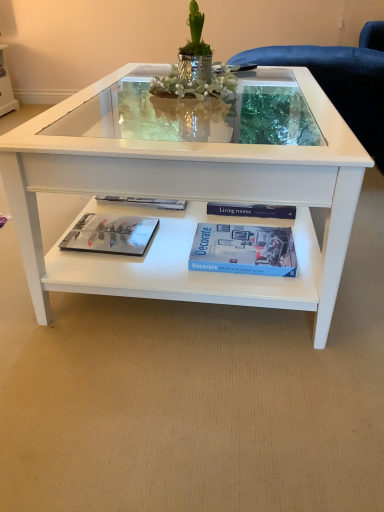
The width and height of the screenshot is (384, 512). Describe the element at coordinates (110, 234) in the screenshot. I see `matte glossy magazine at lower left` at that location.

Identify the location of blue matte book at center. (243, 250).

The width and height of the screenshot is (384, 512). Find the location of `white glossy coffee table at center`. white glossy coffee table at center is located at coordinates (191, 200).

Based on the photo, from the image's perspective, is matte glossy magazine at lower left over white glossy coffee table at center?

No, from the image's perspective, matte glossy magazine at lower left is not on top of white glossy coffee table at center.

How different are the orientations of matte glossy magazine at lower left and white glossy coffee table at center in degrees?

They differ by 0.192 degrees in their facing directions.

Considering the positions of point (96, 222) and point (187, 157), is point (96, 222) closer or farther from the camera than point (187, 157)?

Point (96, 222) is positioned farther from the camera compared to point (187, 157).

Is matte glossy magazine at lower left oriented away from white glossy coffee table at center?

Absolutely, matte glossy magazine at lower left is directed away from white glossy coffee table at center.

At what (x,y) coordinates should I click in order to perform the action: click on paperback book above the matte glossy magazine at lower left (from a real-world perspective). Please return your answer as a coordinate pair (x, y). Looking at the image, I should click on (243, 250).

Can you confirm if matte glossy magazine at lower left is wider than blue matte book at center?

Incorrect, the width of matte glossy magazine at lower left does not surpass that of blue matte book at center.

Could you tell me if matte glossy magazine at lower left is facing blue matte book at center?

No, matte glossy magazine at lower left is not facing towards blue matte book at center.

Is white glossy coffee table at center smaller than matte glossy magazine at lower left?

Actually, white glossy coffee table at center might be larger than matte glossy magazine at lower left.

This screenshot has height=512, width=384. What are the coordinates of `coffee table above the matte glossy magazine at lower left (from the image's perspective)` in the screenshot? It's located at (x=191, y=200).

Can you tell me how much white glossy coffee table at center and matte glossy magazine at lower left differ in facing direction?

The facing directions of white glossy coffee table at center and matte glossy magazine at lower left are 0.192 degrees apart.

Consider the image. Is white glossy coffee table at center not near matte glossy magazine at lower left?

Actually, white glossy coffee table at center and matte glossy magazine at lower left are a little close together.

From a real-world perspective, relative to blue matte book at center, is white glossy coffee table at center vertically above or below?

From a real-world perspective, white glossy coffee table at center is physically above blue matte book at center.

Does white glossy coffee table at center have a smaller size compared to blue matte book at center?

No.

Is white glossy coffee table at center thinner than blue matte book at center?

No.

Is white glossy coffee table at center situated inside blue matte book at center or outside?

white glossy coffee table at center is spatially situated outside blue matte book at center.

Does blue matte book at center have a greater width compared to matte glossy magazine at lower left?

Correct, the width of blue matte book at center exceeds that of matte glossy magazine at lower left.

What's the angular difference between blue matte book at center and matte glossy magazine at lower left's facing directions?

0.796 degrees.

Could you tell me if blue matte book at center is turned towards matte glossy magazine at lower left?

Yes, blue matte book at center is turned towards matte glossy magazine at lower left.

Is blue matte book at center far from matte glossy magazine at lower left?

They are positioned close to each other.

Between blue matte book at center and white glossy coffee table at center, which one has smaller size?

Answer: blue matte book at center.

Which of these two, blue matte book at center or white glossy coffee table at center, is thinner?

Thinner between the two is blue matte book at center.

From a real-world perspective, between blue matte book at center and white glossy coffee table at center, who is vertically higher?

white glossy coffee table at center.

You are a GUI agent. You are given a task and a screenshot of the screen. Output one action in this format:
    pyautogui.click(x=<x>, y=<y>)
    Task: Click on the magazine that appears below the white glossy coffee table at center (from a real-world perspective)
    
    Given the screenshot: What is the action you would take?
    pyautogui.click(x=110, y=234)

The height and width of the screenshot is (512, 384). What are the coordinates of `magazine behind the blue matte book at center` in the screenshot? It's located at (110, 234).

From the image, which object appears to be nearer to white glossy coffee table at center, blue matte book at center or matte glossy magazine at lower left?

blue matte book at center is positioned closer to the anchor white glossy coffee table at center.

Looking at the image, which one is located closer to white glossy coffee table at center, matte glossy magazine at lower left or blue matte book at center?

blue matte book at center is closer to white glossy coffee table at center.

Considering their positions, is white glossy coffee table at center positioned further to matte glossy magazine at lower left than blue matte book at center?

white glossy coffee table at center lies further to matte glossy magazine at lower left than the other object.

Looking at the image, which one is located further to blue matte book at center, matte glossy magazine at lower left or white glossy coffee table at center?

The object further to blue matte book at center is matte glossy magazine at lower left.

Estimate the real-world distances between objects in this image. Which object is further from blue matte book at center, white glossy coffee table at center or matte glossy magazine at lower left?

matte glossy magazine at lower left lies further to blue matte book at center than the other object.

When comparing their distances from matte glossy magazine at lower left, does blue matte book at center or white glossy coffee table at center seem further?

Based on the image, white glossy coffee table at center appears to be further to matte glossy magazine at lower left.

Image resolution: width=384 pixels, height=512 pixels. In order to click on paperback book between matte glossy magazine at lower left and white glossy coffee table at center from left to right in this screenshot , I will do `click(243, 250)`.